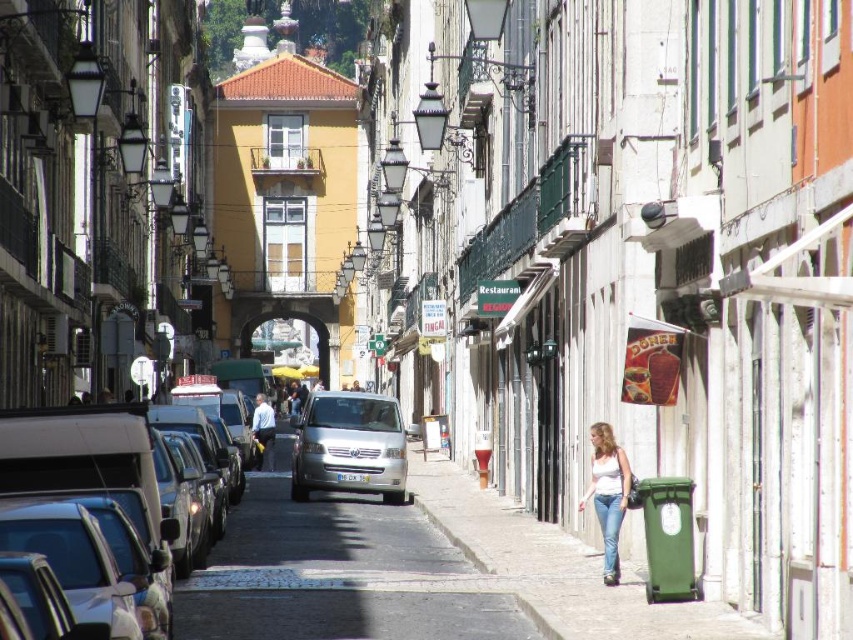
You are a delivery person trying to navigate through the narrow street in Lisbon. You need to deliver a package to a location marked by point (x=599, y=429) and then to point (x=614, y=500). Based on the scene description, which point should you visit first?

Point (x=599, y=429) is behind point (x=614, y=500), so you should visit point (x=614, y=500) first before proceeding to the point (x=599, y=429).